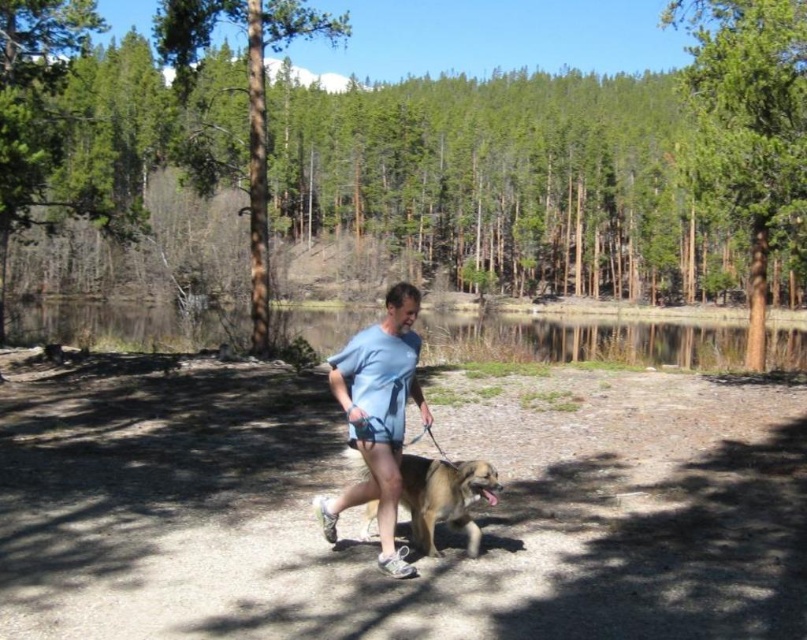
Question: Estimate the real-world distances between objects in this image. Which object is closer to the green rough bark tree at center?

Choices:
 (A) green textured tree at upper right
 (B) smooth dirt path at center
 (C) light blue fabric at center

Answer: (A)

Question: Among these points, which one is nearest to the camera?

Choices:
 (A) (755, 36)
 (B) (145, 195)
 (C) (502, 436)

Answer: (C)

Question: Is smooth dirt path at center below green rough bark tree at center?

Choices:
 (A) yes
 (B) no

Answer: (A)

Question: Observing the image, what is the correct spatial positioning of light blue fabric at center in reference to green textured tree at upper center?

Choices:
 (A) right
 (B) left

Answer: (A)

Question: Does light blue fabric at center have a larger size compared to green textured tree at upper center?

Choices:
 (A) yes
 (B) no

Answer: (B)

Question: Which point is closer to the camera taking this photo?

Choices:
 (A) (402, 355)
 (B) (793, 49)
 (C) (479, 477)

Answer: (A)